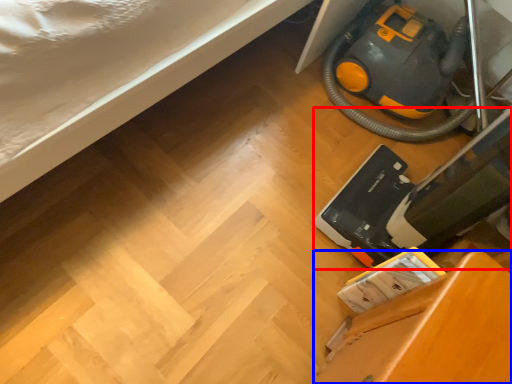
Question: Which point is further to the camera, equipment (highlighted by a red box) or furniture (highlighted by a blue box)?

Choices:
 (A) equipment
 (B) furniture

Answer: (A)